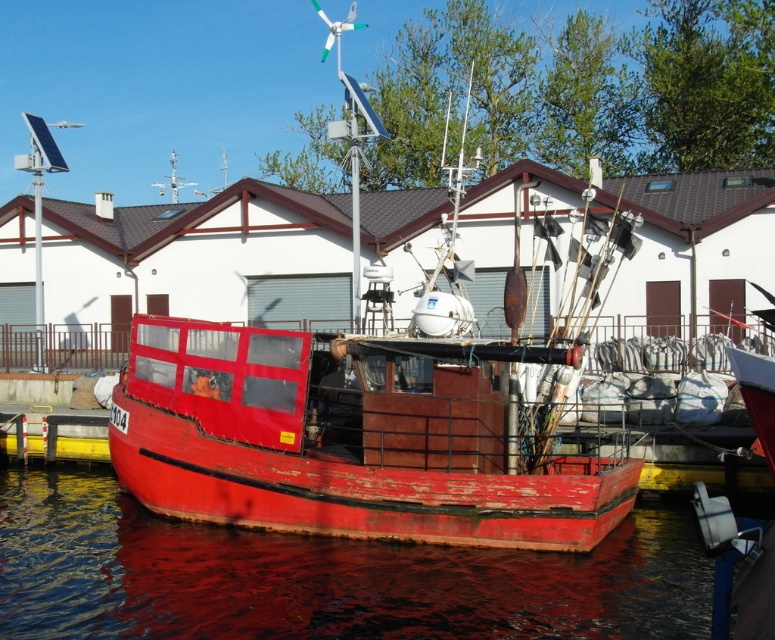
Question: Can you confirm if rusty metal boat at center is positioned below smooth red water at lower center?

Choices:
 (A) no
 (B) yes

Answer: (A)

Question: Which of the following is the farthest from the observer?

Choices:
 (A) smooth red water at lower center
 (B) rusty metal boat at center

Answer: (B)

Question: Which object is farther from the camera taking this photo?

Choices:
 (A) rusty metal boat at center
 (B) smooth red water at lower center

Answer: (A)

Question: Is rusty metal boat at center to the left of smooth red water at lower center from the viewer's perspective?

Choices:
 (A) yes
 (B) no

Answer: (B)

Question: Which of the following is the farthest from the observer?

Choices:
 (A) smooth red water at lower center
 (B) rusty metal boat at center

Answer: (B)

Question: Can you confirm if rusty metal boat at center is positioned to the left of smooth red water at lower center?

Choices:
 (A) yes
 (B) no

Answer: (B)